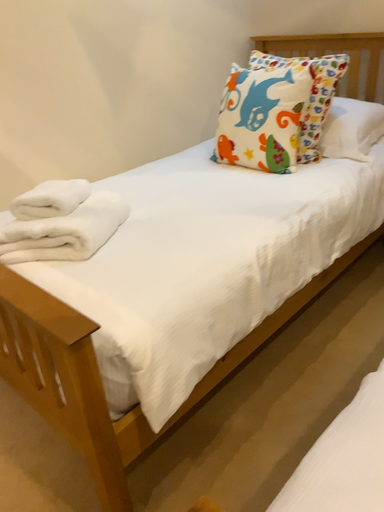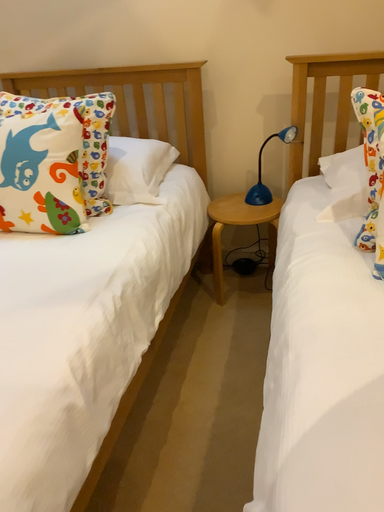
Question: How did the camera likely rotate when shooting the video?

Choices:
 (A) rotated downward
 (B) rotated upward

Answer: (B)